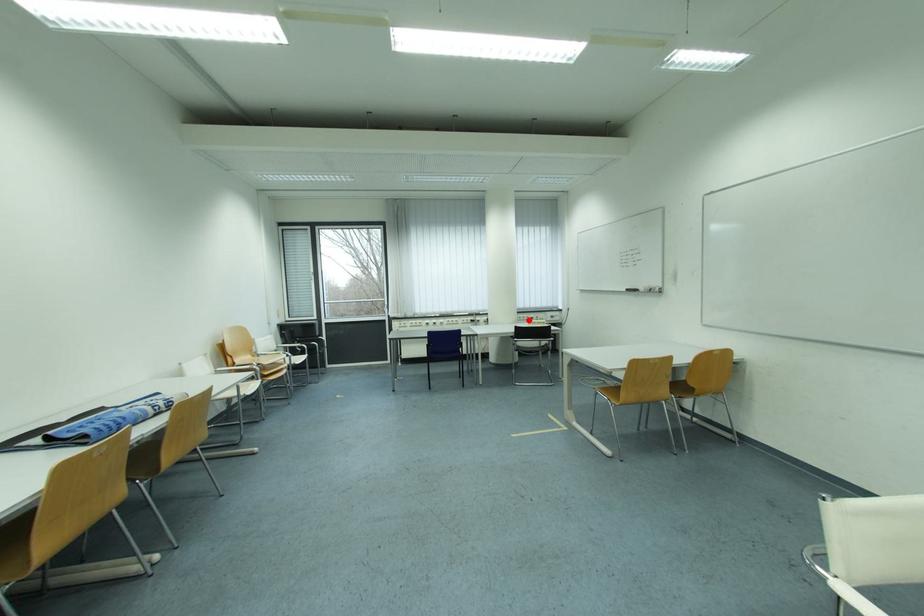
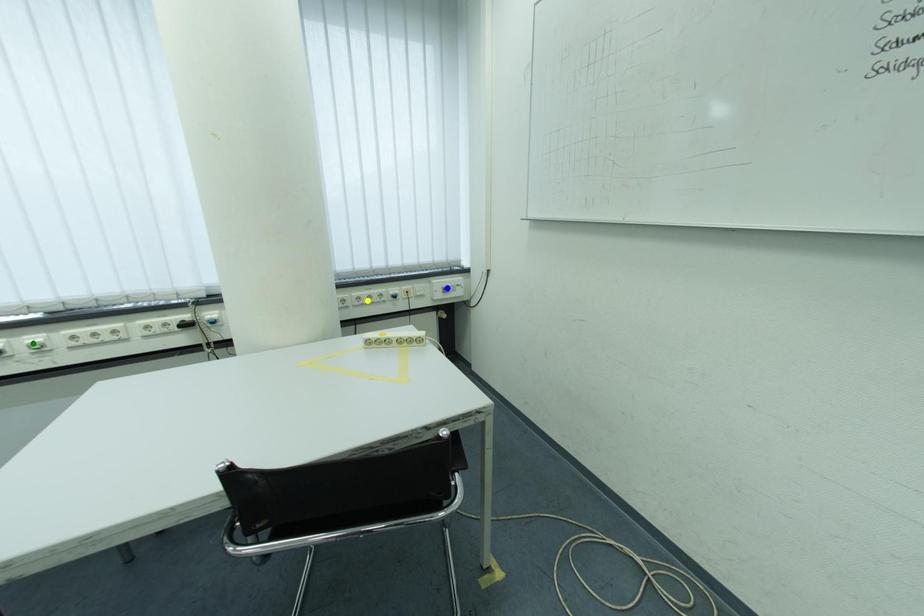
Question: I am providing you with two images of the same scene from different viewpoints. A red point is marked on the first image. You are given multiple points on the second image. Which spot in image 2 lines up with the point in image 1?

Choices:
 (A) yellow point
 (B) green point
 (C) blue point

Answer: (A)